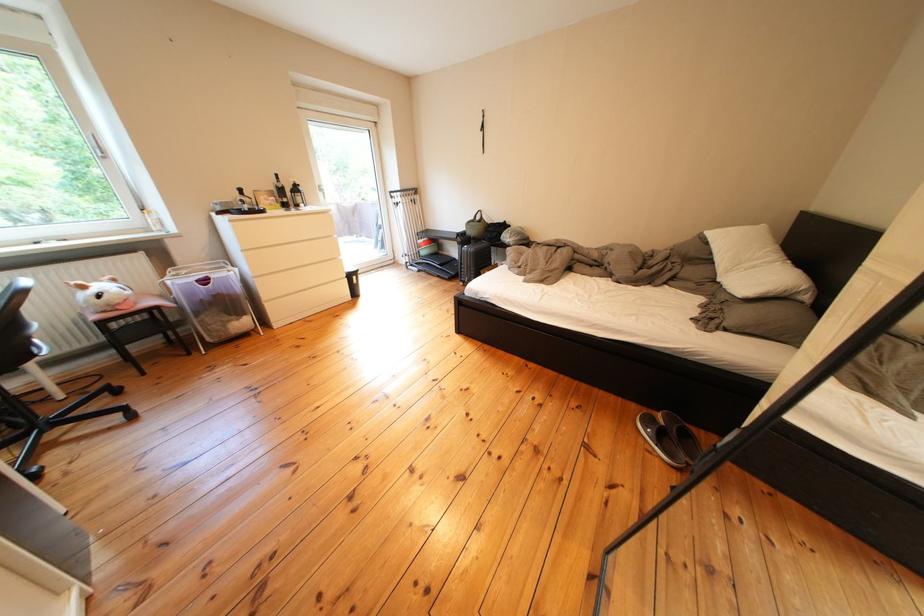
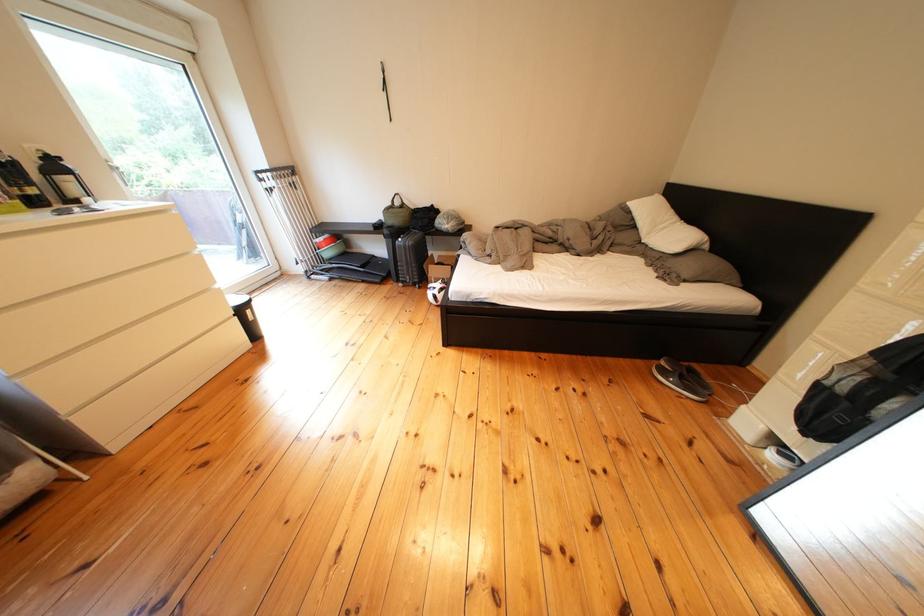
In the second image, find the point that corresponds to pixel 675 419 in the first image.

(676, 368)